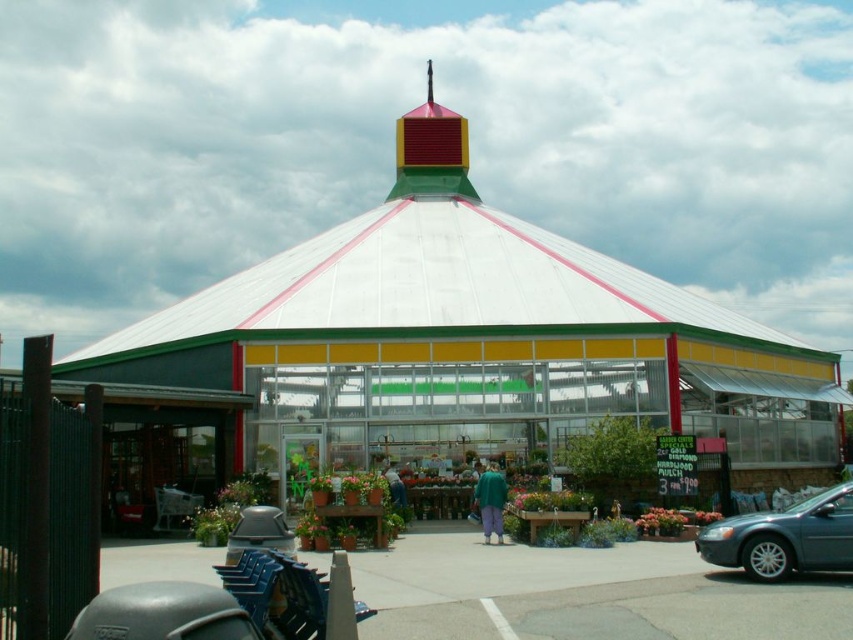
Describe the element at coordinates (468, 339) in the screenshot. I see `transparent glass greenhouse at center` at that location.

Is transparent glass greenhouse at center wider than green matte pants at center?

Correct, the width of transparent glass greenhouse at center exceeds that of green matte pants at center.

This screenshot has width=853, height=640. What are the coordinates of `transparent glass greenhouse at center` in the screenshot? It's located at (468, 339).

How distant is transparent glass greenhouse at center from metallic gray sedan at lower right?

transparent glass greenhouse at center and metallic gray sedan at lower right are 27.86 meters apart.

Is transparent glass greenhouse at center taller than metallic gray sedan at lower right?

Correct, transparent glass greenhouse at center is much taller as metallic gray sedan at lower right.

Describe the element at coordinates (468, 339) in the screenshot. Image resolution: width=853 pixels, height=640 pixels. I see `transparent glass greenhouse at center` at that location.

Find the location of a particular element. This screenshot has height=640, width=853. transparent glass greenhouse at center is located at coordinates (468, 339).

Is metallic gray sedan at lower right thinner than green matte pants at center?

Incorrect, metallic gray sedan at lower right's width is not less than green matte pants at center's.

Which is behind, point (759, 556) or point (498, 488)?

The point (498, 488) is behind.

Locate an element on the screen. Image resolution: width=853 pixels, height=640 pixels. metallic gray sedan at lower right is located at coordinates click(784, 538).